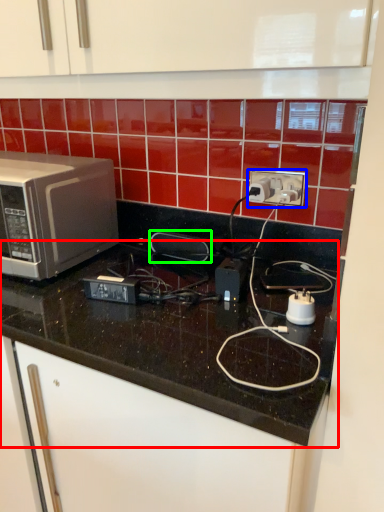
Question: Which object is positioned farthest from countertop (highlighted by a red box)? Select from power plugs and sockets (highlighted by a blue box) and appliance (highlighted by a green box).

Choices:
 (A) power plugs and sockets
 (B) appliance

Answer: (A)